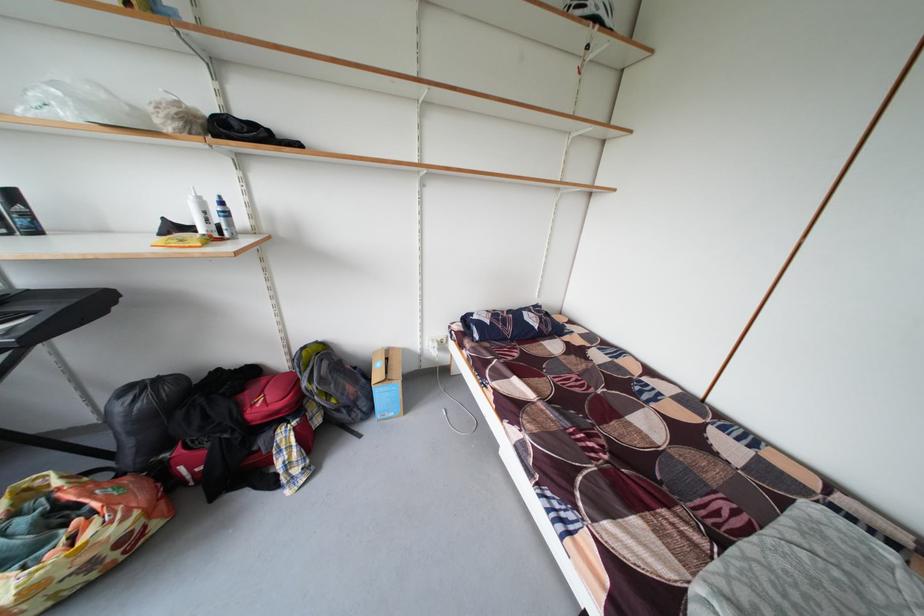
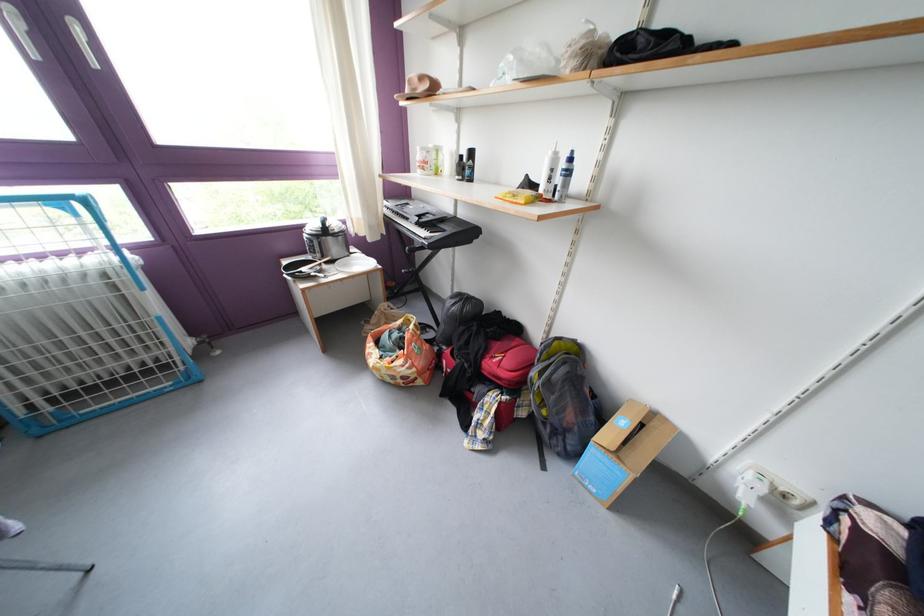
Find the pixel in the second image that matches (314,390) in the first image.

(543, 379)